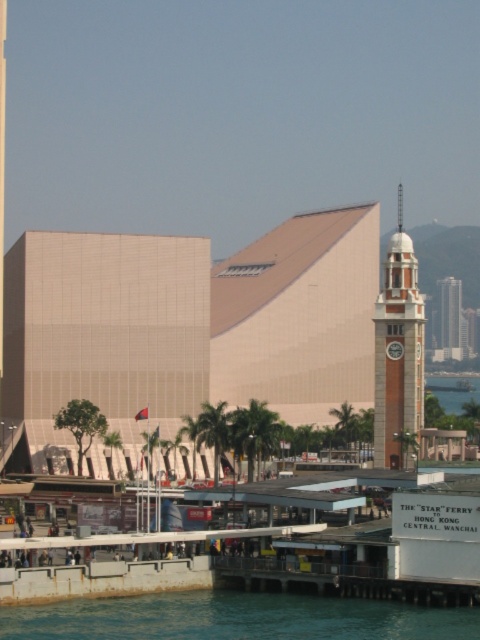
Question: Among these objects, which one is farthest from the camera?

Choices:
 (A) red brick clock tower at center
 (B) clear blue water at lower left
 (C) brick red clock tower at center

Answer: (C)

Question: Which object is closer to the camera taking this photo?

Choices:
 (A) red brick clock tower at center
 (B) brick red clock tower at center

Answer: (A)

Question: Is clear blue water at lower left smaller than brick red clock tower at center?

Choices:
 (A) no
 (B) yes

Answer: (B)

Question: Is clear blue water at lower left further to camera compared to brick red clock tower at center?

Choices:
 (A) yes
 (B) no

Answer: (B)

Question: Which point appears farthest from the camera in this image?

Choices:
 (A) (450, 339)
 (B) (382, 346)
 (C) (305, 609)

Answer: (A)

Question: Where is clear blue water at lower left located in relation to red brick clock tower at center in the image?

Choices:
 (A) right
 (B) left

Answer: (B)